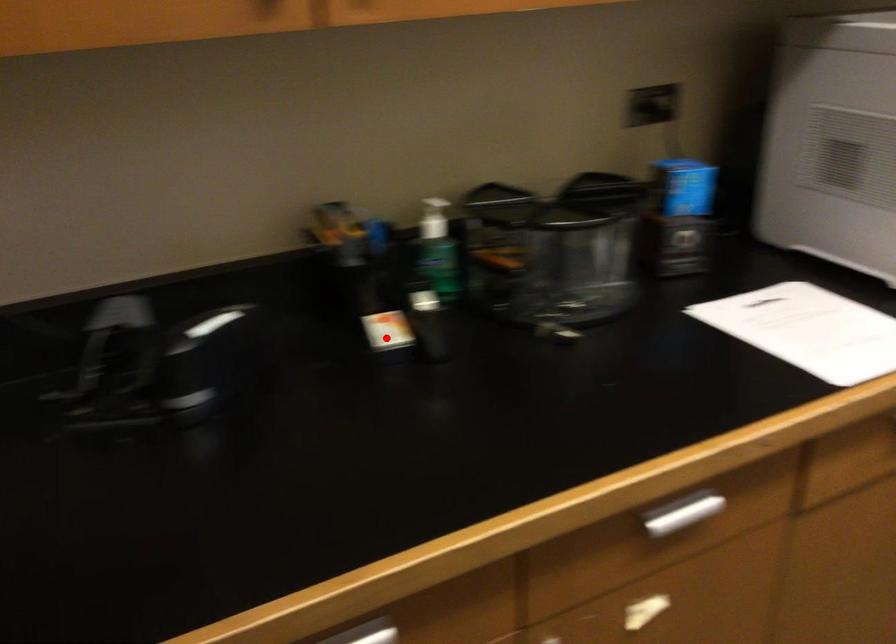
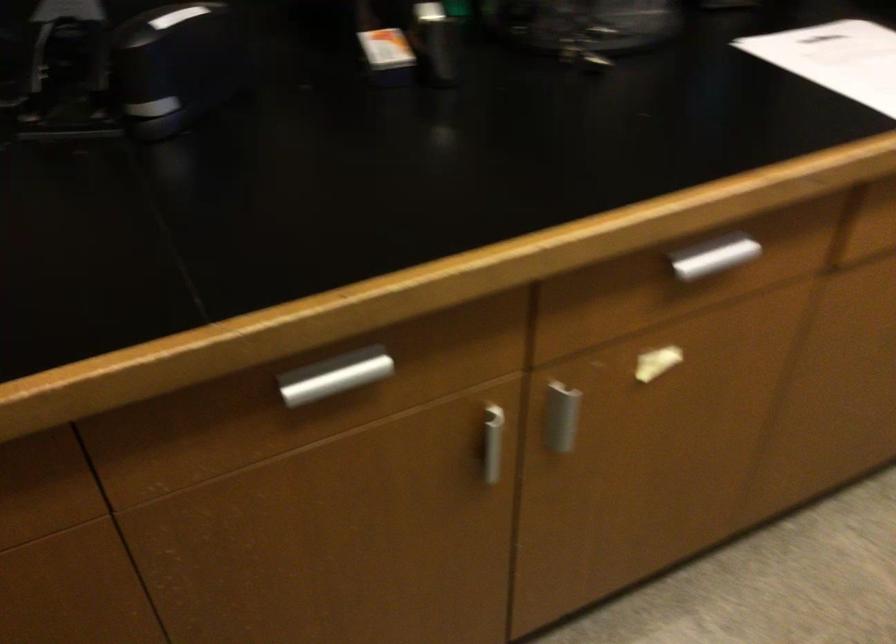
Question: I am providing you with two images of the same scene from different viewpoints. A red point is shown in image1. For the corresponding object point in image2, is it positioned nearer or farther from the camera?

Choices:
 (A) Nearer
 (B) Farther

Answer: (A)